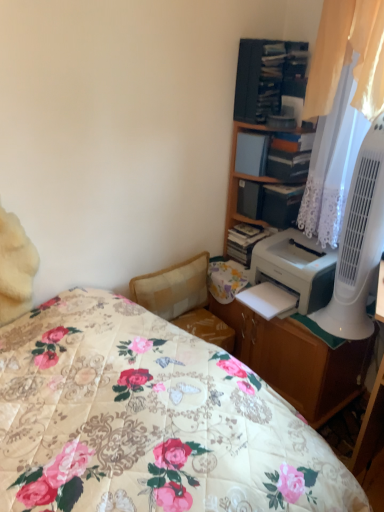
Question: Is white plastic fan at right smaller than beige fabric swivel chair at center?

Choices:
 (A) no
 (B) yes

Answer: (B)

Question: From a real-world perspective, is white plastic fan at right physically above beige fabric swivel chair at center?

Choices:
 (A) no
 (B) yes

Answer: (B)

Question: Considering the relative sizes of white plastic fan at right and beige fabric swivel chair at center in the image provided, is white plastic fan at right shorter than beige fabric swivel chair at center?

Choices:
 (A) no
 (B) yes

Answer: (A)

Question: Is white plastic fan at right directly adjacent to beige fabric swivel chair at center?

Choices:
 (A) no
 (B) yes

Answer: (A)

Question: Does white plastic fan at right have a greater height compared to beige fabric swivel chair at center?

Choices:
 (A) yes
 (B) no

Answer: (A)

Question: From the image's perspective, is white plastic printer at right located above or below white plastic fan at right?

Choices:
 (A) below
 (B) above

Answer: (A)

Question: Looking at the image, does white plastic printer at right seem bigger or smaller compared to white plastic fan at right?

Choices:
 (A) small
 (B) big

Answer: (B)

Question: Considering the positions of point (317, 306) and point (382, 206), is point (317, 306) closer or farther from the camera than point (382, 206)?

Choices:
 (A) farther
 (B) closer

Answer: (A)

Question: From a real-world perspective, is white plastic printer at right positioned above or below white plastic fan at right?

Choices:
 (A) above
 (B) below

Answer: (B)

Question: In the image, is matte white book at upper right, the first book positioned from the left, on the left side or the right side of hardcover book at upper right, acting as the 2th book starting from the left?

Choices:
 (A) right
 (B) left

Answer: (B)

Question: Would you say matte white book at upper right, the 2th book viewed from the right, is inside or outside hardcover book at upper right, the 1th book viewed from the right?

Choices:
 (A) outside
 (B) inside

Answer: (A)

Question: Does point (246, 172) appear closer or farther from the camera than point (294, 150)?

Choices:
 (A) closer
 (B) farther

Answer: (B)

Question: From the image's perspective, is matte white book at upper right, the first book positioned from the left, located above or below hardcover book at upper right, the 1th book viewed from the right?

Choices:
 (A) above
 (B) below

Answer: (A)

Question: Based on their positions, is matte white book at upper right, the first book positioned from the left, located to the left or right of matte plastic shelf at upper right, the 1th shelf in the bottom-to-top sequence?

Choices:
 (A) right
 (B) left

Answer: (B)

Question: Is point (261, 169) closer or farther from the camera than point (276, 215)?

Choices:
 (A) farther
 (B) closer

Answer: (B)